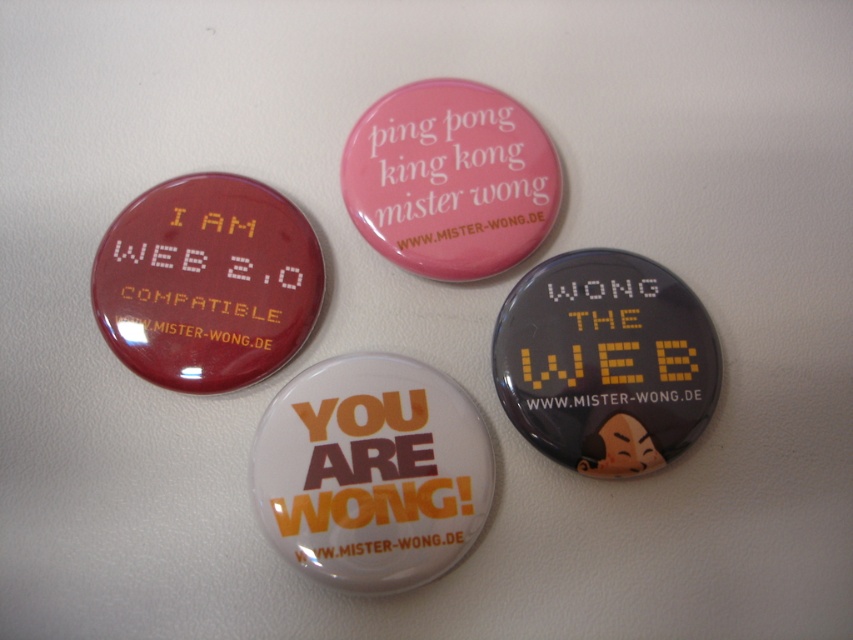
Question: Where is matte red badge at upper left located in relation to pink glossy button at upper center in the image?

Choices:
 (A) left
 (B) right

Answer: (A)

Question: Which object is closer to the camera taking this photo?

Choices:
 (A) matte black button at center
 (B) matte red badge at upper left
 (C) pink glossy button at upper center

Answer: (A)

Question: Considering the real-world distances, which object is closest to the white glossy badge at center?

Choices:
 (A) pink glossy button at upper center
 (B) matte red badge at upper left
 (C) matte black button at center
 (D) black matte text at center

Answer: (B)

Question: Which point is closer to the camera?

Choices:
 (A) (456, 544)
 (B) (173, 362)
 (C) (662, 422)
 (D) (554, 401)

Answer: (A)

Question: Is pink glossy button at upper center bigger than black matte text at center?

Choices:
 (A) yes
 (B) no

Answer: (A)

Question: Can you confirm if white glossy badge at center is positioned below black matte text at center?

Choices:
 (A) yes
 (B) no

Answer: (A)